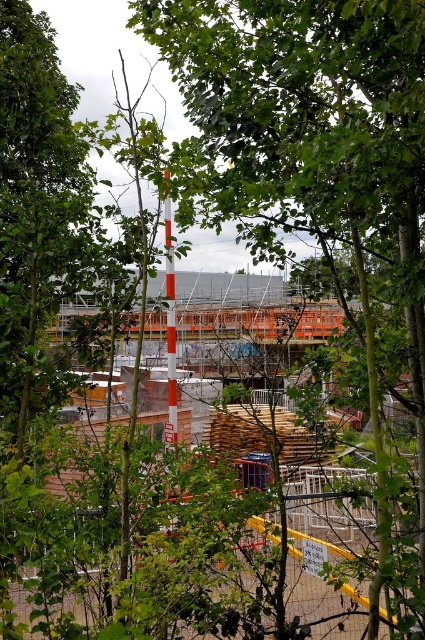
Who is higher up, yellow metal fence at lower center or smooth orange pole at center?

smooth orange pole at center is above.

Is point (121, 589) in front of point (173, 419)?

Yes, point (121, 589) is in front of point (173, 419).

The height and width of the screenshot is (640, 425). Find the location of `yellow metal fence at lower center`. yellow metal fence at lower center is located at coordinates (139, 554).

Find the location of `green leafy tree at center`. green leafy tree at center is located at coordinates (316, 166).

Does green leafy tree at center appear under yellow metal fence at lower center?

Actually, green leafy tree at center is above yellow metal fence at lower center.

This screenshot has width=425, height=640. Find the location of `green leafy tree at center`. green leafy tree at center is located at coordinates (316, 166).

Between point (408, 19) and point (172, 387), which one is positioned in front?

Point (408, 19)

Is point (356, 193) positioned before point (175, 384)?

Yes.

Locate an element on the screen. green leafy tree at center is located at coordinates (316, 166).